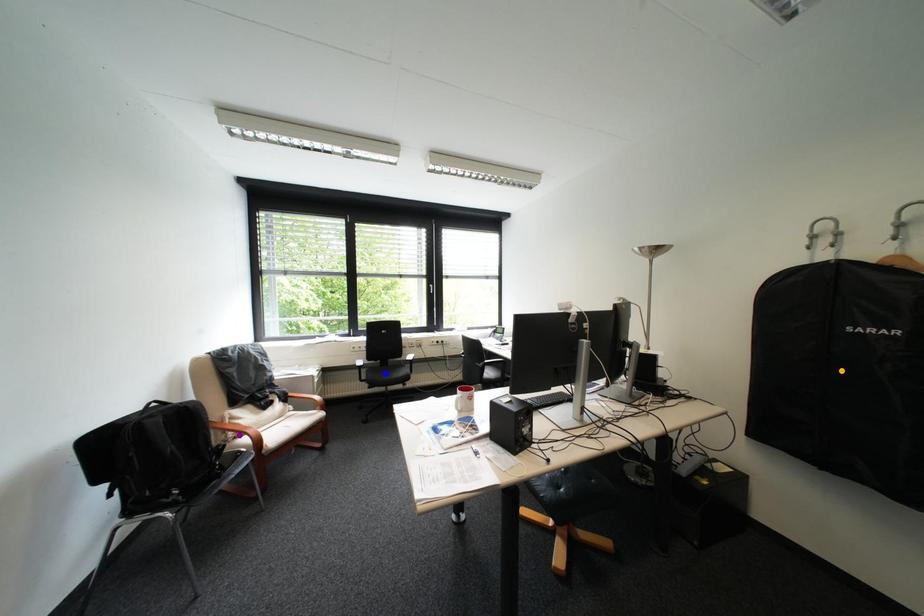
Order these from nearest to farthest:
1. orange point
2. blue point
3. purple point

blue point
purple point
orange point